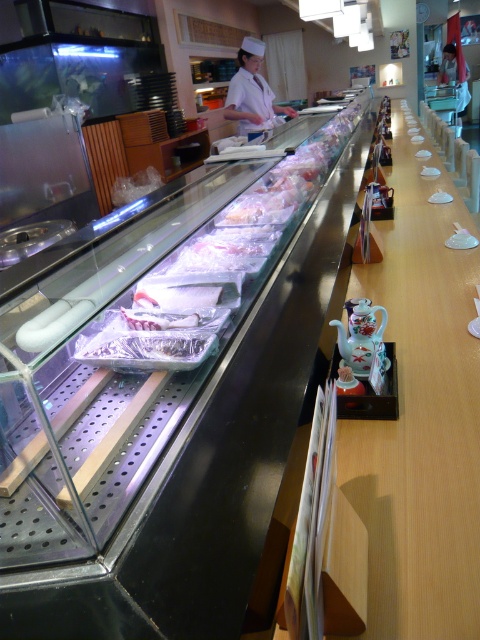
Which is behind, point (239, 74) or point (369, 310)?

The point (239, 74) is more distant.

Does white uniform at center have a greater width compared to porcelain teapot at center?

Yes.

Which is behind, point (247, 38) or point (356, 314)?

Point (247, 38)

In order to click on white uniform at center in this screenshot , I will do (252, 92).